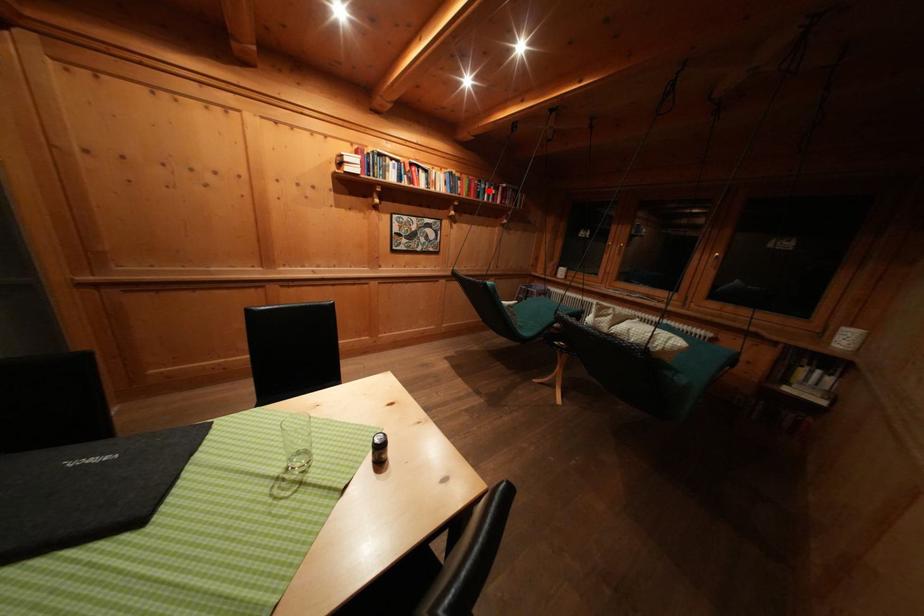
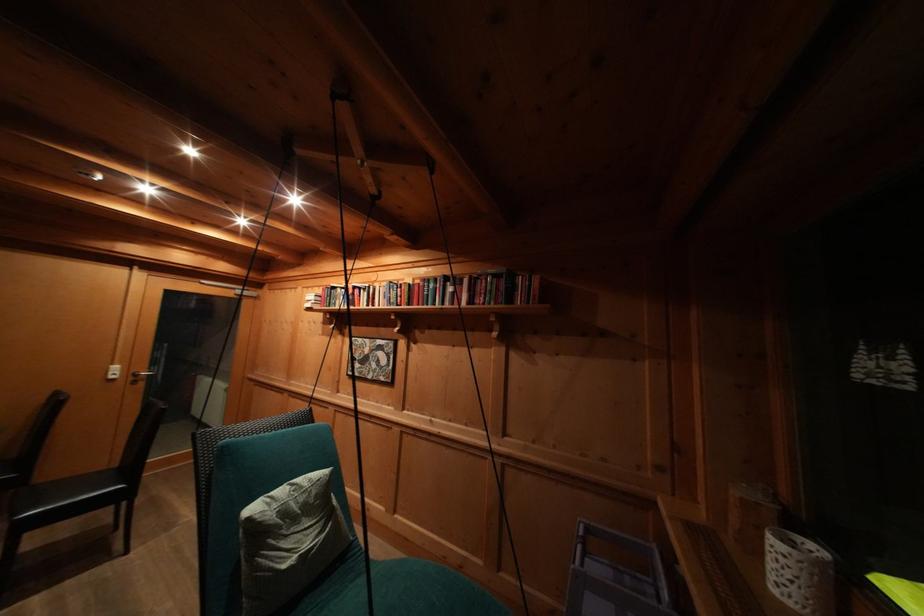
Question: I am providing you with two images of the same scene from different viewpoints. Image1 has a red point marked. In image2, the corresponding 3D location appears at what relative position? Reply with the corresponding letter.

Choices:
 (A) Closer
 (B) Farther

Answer: (B)